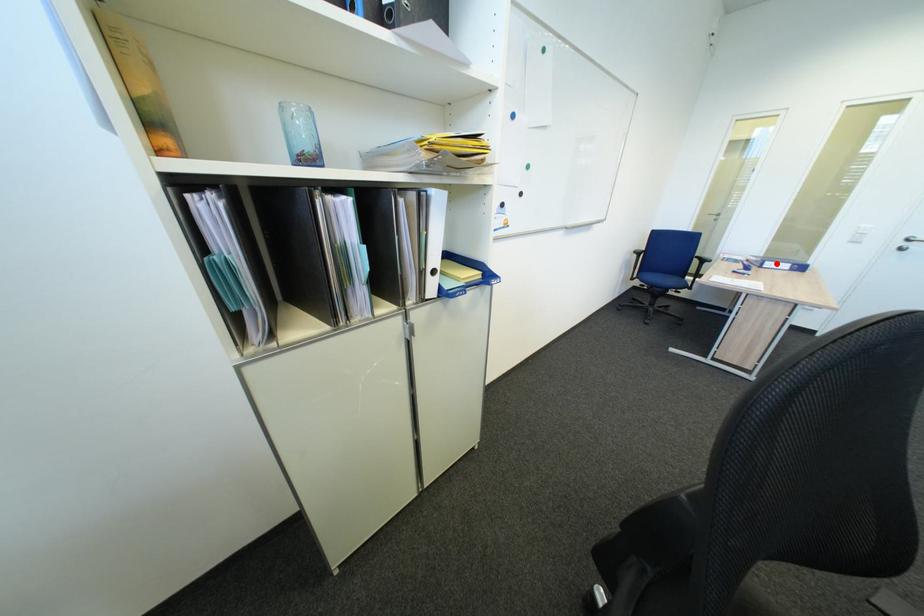
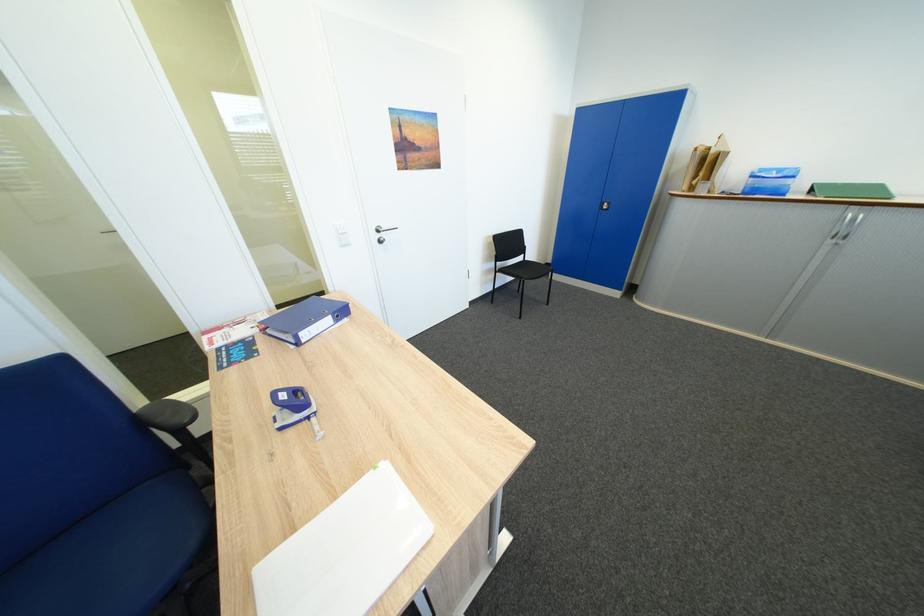
Question: I am providing you with two images of the same scene from different viewpoints. Image1 has a red point marked. In image2, the corresponding 3D location appears at what relative position? Reply with the corresponding letter.

Choices:
 (A) Closer
 (B) Farther

Answer: (A)